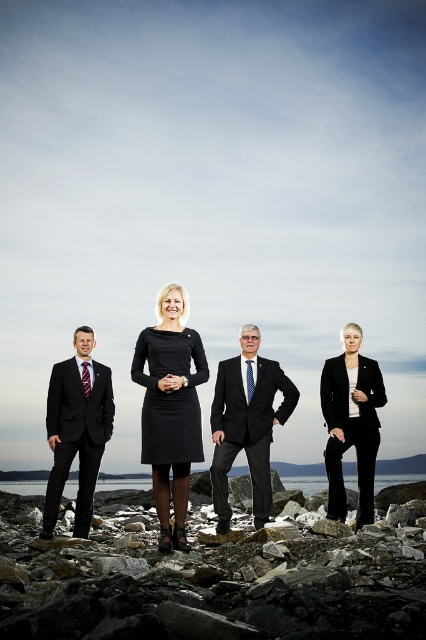
You are a photographer setting up for a group photo. You have two subjects wearing black formal wear in the scene. The first is the matte black suit at center and the second is the black matte blazer at right. Which one do you need to position closer to the camera to ensure both appear the same size in the photo?

You should position the black matte blazer at right closer to the camera because the matte black suit at center might be wider than the black matte blazer at right, so moving the smaller one forward would balance their sizes in the photo.

You are navigating a drone that needs to fly from point A to point B. The coordinates for point A are point (x=63, y=540) and point B are point (x=333, y=458). According to the image, which point is closer to the group of people?

Point (x=63, y=540) is closer to the group of people because it is in front of point (x=333, y=458).

You are a photographer preparing to take a group photo of the matte black suit at center and the black matte blazer at right. Based on their current positions, which one should you place on the right side of the photo to align with their current arrangement?

The black matte blazer at right should be placed on the right side of the photo because it is already positioned to the right of the matte black suit at center in the current arrangement.